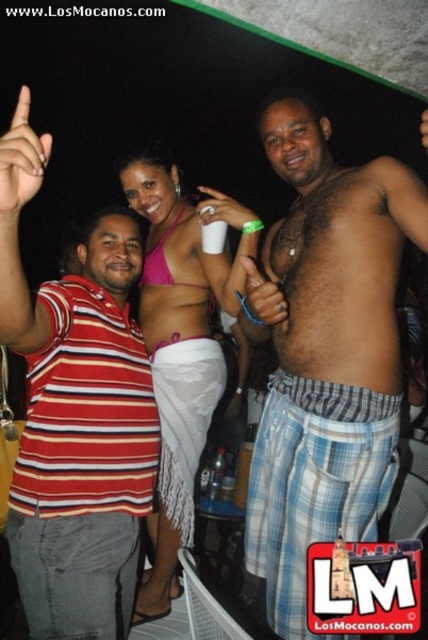
Can you confirm if smooth skin torso at center is bigger than hairy skin at center?

Yes.

Is smooth skin torso at center positioned in front of hairy skin at center?

That is False.

Which is behind, point (165, 566) or point (377, 328)?

The point (165, 566) is more distant.

Locate an element on the screen. This screenshot has width=428, height=640. smooth skin torso at center is located at coordinates (181, 344).

Who is shorter, shiny plaid shorts at center or hairy skin at center?

hairy skin at center

In order to click on shiny plaid shorts at center in this screenshot , I will do `click(324, 355)`.

Is striped cotton shirt at left further to the viewer compared to hairy skin at center?

That is False.

In the scene shown: Can you confirm if striped cotton shirt at left is positioned below hairy skin at center?

Yes.

Which is behind, point (53, 472) or point (353, 179)?

Point (53, 472)

Locate an element on the screen. The height and width of the screenshot is (640, 428). striped cotton shirt at left is located at coordinates (76, 413).